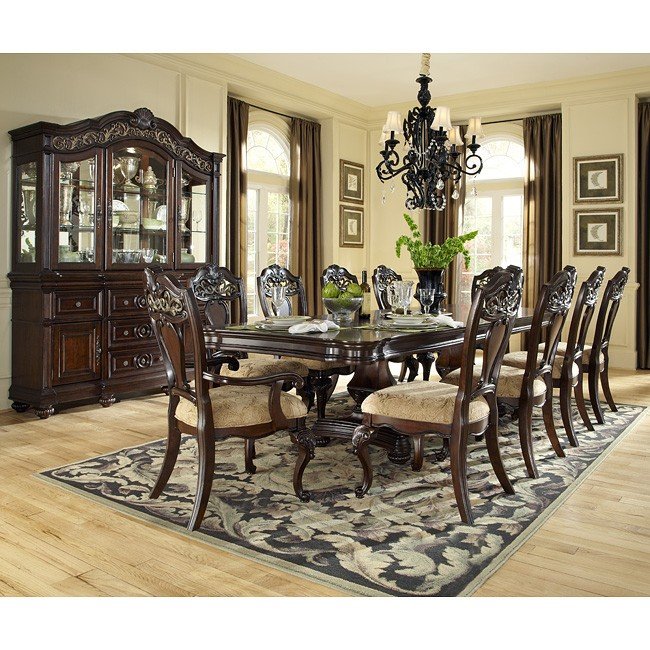
The image size is (650, 650). Find the location of `back legs of chairs to the furthest right`. back legs of chairs to the furthest right is located at coordinates coord(465,491), coord(506,485), coord(530,455), coord(552,431), coord(566,422), coord(585,410), coord(593,403), coord(606,395).